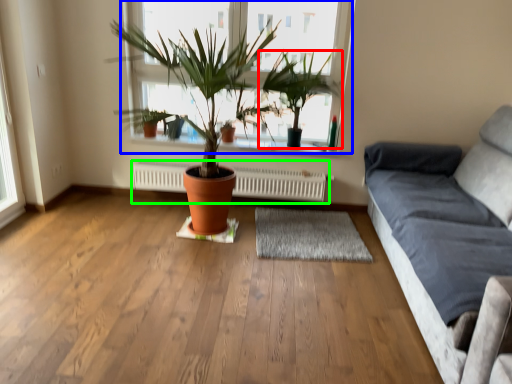
Question: Based on their relative distances, which object is farther from houseplant (highlighted by a red box)? Choose from window (highlighted by a blue box) and heater (highlighted by a green box).

Choices:
 (A) window
 (B) heater

Answer: (B)